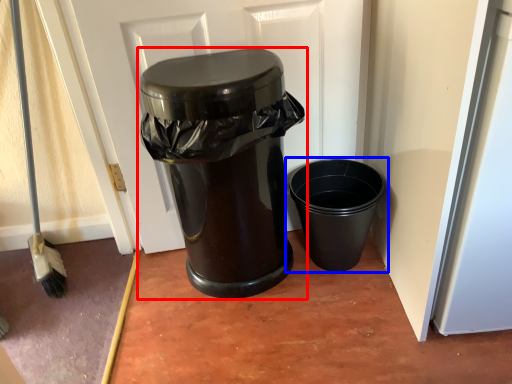
Question: Which object is closer to the camera taking this photo, waste container (highlighted by a red box) or waste container (highlighted by a blue box)?

Choices:
 (A) waste container
 (B) waste container

Answer: (A)